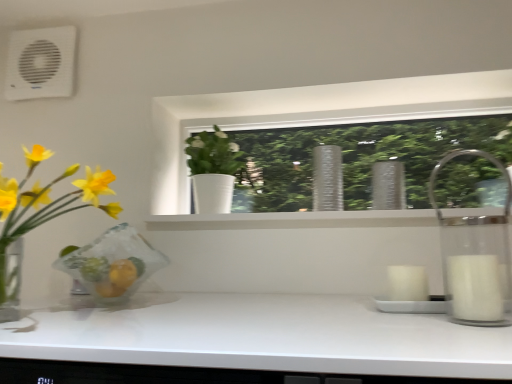
Measure the distance between white matte pot at center, the 2th houseplant in the left-to-right sequence, and camera.

white matte pot at center, the 2th houseplant in the left-to-right sequence, is 1.21 meters away from camera.

This screenshot has height=384, width=512. What do you see at coordinates (40, 214) in the screenshot?
I see `translucent glass vase at left, positioned as the second houseplant in right-to-left order` at bounding box center [40, 214].

In order to click on clear glass vase at center in this screenshot , I will do `click(327, 178)`.

Is the depth of translucent glass vase at left, positioned as the second houseplant in right-to-left order, greater than that of white matte pot at center, the 1th houseplant in the right-to-left sequence?

No, it is in front of white matte pot at center, the 1th houseplant in the right-to-left sequence.

Which point is more distant from viewer, (48, 183) or (196, 176)?

The point (196, 176) is farther.

From a real-world perspective, is translucent glass vase at left, which is the 1th houseplant from front to back, above or below white matte pot at center, the 1th houseplant in the right-to-left sequence?

From a real-world perspective, translucent glass vase at left, which is the 1th houseplant from front to back, is physically below white matte pot at center, the 1th houseplant in the right-to-left sequence.

Which is behind, point (206, 200) or point (69, 250)?

The point (206, 200) is farther from the camera.

I want to click on houseplant above the translucent glass vase at left, which is the 1th houseplant from front to back (from the image's perspective), so click(213, 170).

Can you confirm if white matte pot at center, the 1th houseplant in the right-to-left sequence, is positioned to the right of translucent glass vase at left, the first houseplant when ordered from left to right?

Indeed, white matte pot at center, the 1th houseplant in the right-to-left sequence, is positioned on the right side of translucent glass vase at left, the first houseplant when ordered from left to right.

From the image's perspective, who appears lower, white matte pot at center, the 1th houseplant in the right-to-left sequence, or translucent glass vase at left, positioned as the second houseplant in right-to-left order?

translucent glass vase at left, positioned as the second houseplant in right-to-left order.

Looking at the image, does translucent glass vase at left, the first houseplant when ordered from left to right, seem bigger or smaller compared to clear glass vase at center?

Considering their sizes, translucent glass vase at left, the first houseplant when ordered from left to right, takes up more space than clear glass vase at center.

Can we say translucent glass vase at left, the first houseplant when ordered from left to right, lies outside clear glass vase at center?

Yes.

What's the angular difference between translucent glass vase at left, the first houseplant when ordered from left to right, and clear glass vase at center's facing directions?

translucent glass vase at left, the first houseplant when ordered from left to right, and clear glass vase at center are facing 1.06 degrees away from each other.

Is translucent glass vase at left, the first houseplant when ordered from left to right, closer to the viewer compared to clear glass vase at center?

That is True.

Considering their positions, is clear glass vase at center located in front of or behind white plastic air conditioning unit at upper left?

Clearly, clear glass vase at center is in front of white plastic air conditioning unit at upper left.

Considering the relative positions of clear glass vase at center and white plastic air conditioning unit at upper left in the image provided, is clear glass vase at center to the right of white plastic air conditioning unit at upper left from the viewer's perspective?

Correct, you'll find clear glass vase at center to the right of white plastic air conditioning unit at upper left.

Is point (340, 196) behind point (53, 93)?

No, (340, 196) is closer to viewer.

How distant is clear glass vase at center from white plastic air conditioning unit at upper left?

clear glass vase at center is 34.40 inches from white plastic air conditioning unit at upper left.

From a real-world perspective, is white plastic air conditioning unit at upper left positioned above or below clear glass vase at center?

Clearly, from a real-world perspective, white plastic air conditioning unit at upper left is above clear glass vase at center.

Is clear glass vase at center a part of white plastic air conditioning unit at upper left?

Definitely not — clear glass vase at center is not inside white plastic air conditioning unit at upper left.

Between point (14, 37) and point (338, 166), which one is positioned behind?

The point (14, 37) is more distant.

Is white matte pot at center, the 2th houseplant when ordered from front to back, aimed at white plastic air conditioning unit at upper left?

No, white matte pot at center, the 2th houseplant when ordered from front to back, is not facing towards white plastic air conditioning unit at upper left.

Does white matte pot at center, the 1th houseplant in the right-to-left sequence, have a lesser width compared to white plastic air conditioning unit at upper left?

In fact, white matte pot at center, the 1th houseplant in the right-to-left sequence, might be wider than white plastic air conditioning unit at upper left.

Consider the image. Is white matte pot at center, the 2th houseplant in the left-to-right sequence, at the left side of white plastic air conditioning unit at upper left?

Incorrect, white matte pot at center, the 2th houseplant in the left-to-right sequence, is not on the left side of white plastic air conditioning unit at upper left.

Considering the relative sizes of white matte pot at center, the 2th houseplant when ordered from front to back, and white plastic air conditioning unit at upper left in the image provided, is white matte pot at center, the 2th houseplant when ordered from front to back, smaller than white plastic air conditioning unit at upper left?

No.

Which of these two, white plastic air conditioning unit at upper left or white matte pot at center, the 1th houseplant in the right-to-left sequence, stands taller?

white matte pot at center, the 1th houseplant in the right-to-left sequence, is taller.

Is point (51, 36) positioned behind point (209, 164)?

Yes, it is behind point (209, 164).

Is white plastic air conditioning unit at upper left further to the viewer compared to white matte pot at center, the 2th houseplant in the left-to-right sequence?

Yes, it is.

Is white matte pot at center, the 2th houseplant when ordered from front to back, inside white plastic air conditioning unit at upper left?

That's incorrect, white matte pot at center, the 2th houseplant when ordered from front to back, is not inside white plastic air conditioning unit at upper left.

At what (x,y) coordinates should I click in order to perform the action: click on houseplant that is above the translucent glass vase at left, the first houseplant when ordered from left to right (from the image's perspective). Please return your answer as a coordinate pair (x, y). This screenshot has width=512, height=384. Looking at the image, I should click on (213, 170).

The width and height of the screenshot is (512, 384). Identify the location of houseplant that is above the translucent glass vase at left, which is the 1th houseplant from front to back (from a real-world perspective). (213, 170).

Looking at the image, which one is located further to white matte pot at center, the 2th houseplant in the left-to-right sequence, clear glass vase at center or white plastic air conditioning unit at upper left?

white plastic air conditioning unit at upper left lies further to white matte pot at center, the 2th houseplant in the left-to-right sequence, than the other object.

From the image, which object appears to be nearer to white plastic air conditioning unit at upper left, translucent glass vase at left, positioned as the second houseplant in right-to-left order, or clear glass vase at center?

translucent glass vase at left, positioned as the second houseplant in right-to-left order.

From the image, which object appears to be farther from translucent glass vase at left, positioned as the second houseplant in back-to-front order, clear glass vase at center or white matte pot at center, the 2th houseplant in the left-to-right sequence?

clear glass vase at center is further to translucent glass vase at left, positioned as the second houseplant in back-to-front order.

Considering their positions, is translucent glass vase at left, positioned as the second houseplant in right-to-left order, positioned further to clear glass vase at center than white matte pot at center, the 2th houseplant in the left-to-right sequence?

Among the two, translucent glass vase at left, positioned as the second houseplant in right-to-left order, is located further to clear glass vase at center.

Estimate the real-world distances between objects in this image. Which object is closer to clear glass vase at center, translucent glass vase at left, which is the 1th houseplant from front to back, or white plastic air conditioning unit at upper left?

translucent glass vase at left, which is the 1th houseplant from front to back, lies closer to clear glass vase at center than the other object.

Looking at the image, which one is located closer to translucent glass vase at left, which is the 1th houseplant from front to back, white plastic air conditioning unit at upper left or clear glass vase at center?

white plastic air conditioning unit at upper left is positioned closer to the anchor translucent glass vase at left, which is the 1th houseplant from front to back.

Which object lies further to the anchor point white plastic air conditioning unit at upper left, white matte pot at center, the first houseplant positioned from the back, or translucent glass vase at left, which is the 1th houseplant from front to back?

Among the two, white matte pot at center, the first houseplant positioned from the back, is located further to white plastic air conditioning unit at upper left.

Which object lies further to the anchor point white matte pot at center, the 2th houseplant when ordered from front to back, white plastic air conditioning unit at upper left or clear glass vase at center?

Among the two, white plastic air conditioning unit at upper left is located further to white matte pot at center, the 2th houseplant when ordered from front to back.

Image resolution: width=512 pixels, height=384 pixels. Find the location of `houseplant positioned between translucent glass vase at left, positioned as the second houseplant in back-to-front order, and white plastic air conditioning unit at upper left from near to far`. houseplant positioned between translucent glass vase at left, positioned as the second houseplant in back-to-front order, and white plastic air conditioning unit at upper left from near to far is located at coordinates (213, 170).

The width and height of the screenshot is (512, 384). Find the location of `vase between translucent glass vase at left, the first houseplant when ordered from left to right, and white matte pot at center, the 1th houseplant in the right-to-left sequence, in the front-back direction`. vase between translucent glass vase at left, the first houseplant when ordered from left to right, and white matte pot at center, the 1th houseplant in the right-to-left sequence, in the front-back direction is located at coordinates (327, 178).